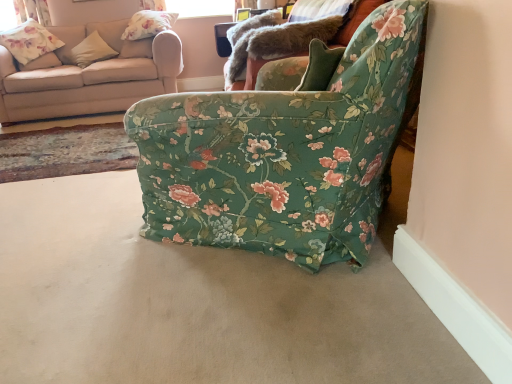
Question: From a real-world perspective, is beige fabric pillow at upper left, which is counted as the 2th pillow, starting from the right, above or below floral fabric curtain at upper left?

Choices:
 (A) above
 (B) below

Answer: (B)

Question: Is beige fabric pillow at upper left, which is counted as the 2th pillow, starting from the right, bigger or smaller than floral fabric curtain at upper left?

Choices:
 (A) big
 (B) small

Answer: (A)

Question: Considering the real-world distances, which object is farthest from the floral fabric pillow at upper left, which appears as the first pillow when viewed from the right?

Choices:
 (A) beige fabric couch at upper left
 (B) floral fabric armchair at center
 (C) beige carpet at lower center
 (D) floral fabric curtain at upper left
 (E) floral fabric pillow at upper left

Answer: (C)

Question: Which object is positioned closest to the floral fabric curtain at upper left?

Choices:
 (A) floral fabric pillow at upper left, acting as the second pillow starting from the left
 (B) beige carpet at lower center
 (C) floral fabric armchair at center
 (D) floral fabric pillow at upper left
 (E) beige fabric pillow at upper left, positioned as the 1th pillow in left-to-right order

Answer: (D)